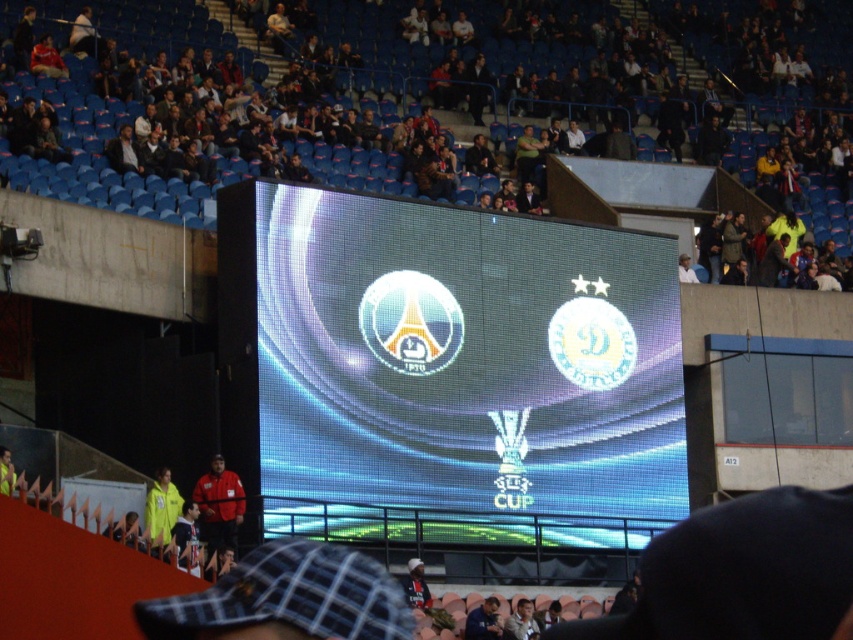
Is shiny led display at center closer to the viewer compared to red jacket at lower left?

Yes, it is in front of red jacket at lower left.

Is point (512, 416) positioned after point (241, 486)?

Yes, point (512, 416) is behind point (241, 486).

Is point (393, 381) positioned after point (219, 493)?

Yes, it is.

Where is `shiny led display at center`? shiny led display at center is located at coordinates (463, 374).

Based on the photo, can you confirm if dark blue seats at upper center is thinner than shiny led display at center?

Incorrect, dark blue seats at upper center's width is not less than shiny led display at center's.

Is point (834, 218) positioned in front of point (450, 358)?

That is False.

Describe the element at coordinates (448, 100) in the screenshot. I see `dark blue seats at upper center` at that location.

Identify the location of dark blue seats at upper center. The height and width of the screenshot is (640, 853). (448, 100).

The height and width of the screenshot is (640, 853). Describe the element at coordinates (219, 504) in the screenshot. I see `red jacket at lower left` at that location.

Is red jacket at lower left behind yellow fabric jacket at lower left?

Yes, red jacket at lower left is further from the viewer.

Where is `red jacket at lower left`? This screenshot has width=853, height=640. red jacket at lower left is located at coordinates (219, 504).

Where is `red jacket at lower left`? red jacket at lower left is located at coordinates click(219, 504).